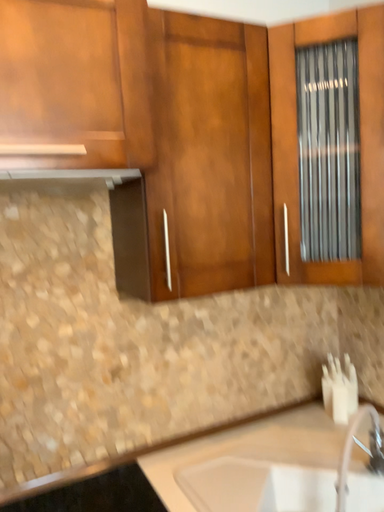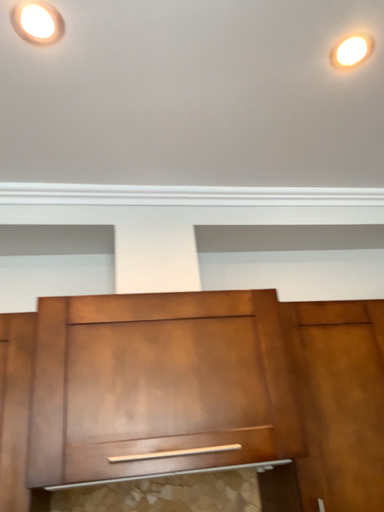
Question: Which way did the camera rotate in the video?

Choices:
 (A) rotated upward
 (B) rotated downward

Answer: (A)